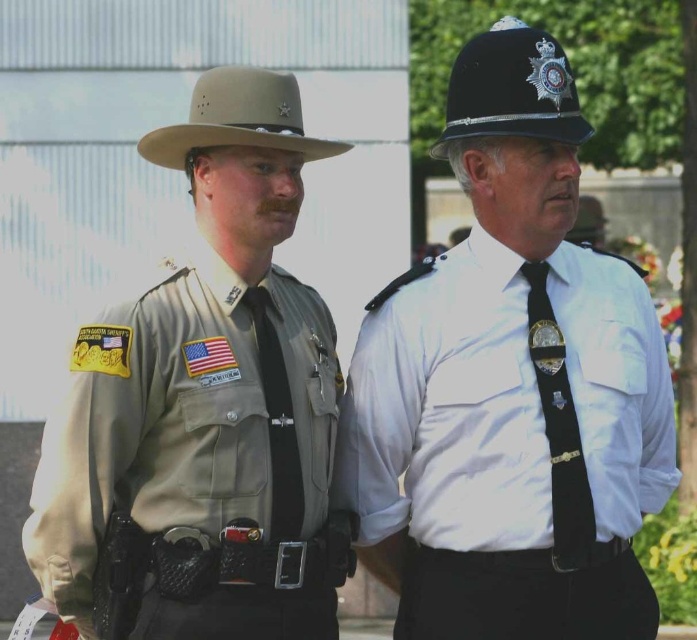
Question: Among these points, which one is farthest from the camera?

Choices:
 (A) (560, 97)
 (B) (243, 436)
 (C) (162, 157)

Answer: (C)

Question: Which is farther from the tan felt cowboy hat at upper left?

Choices:
 (A) tan uniform at left
 (B) white glossy shirt at center
 (C) black matte helmet at upper center

Answer: (B)

Question: Which object is closer to the camera taking this photo?

Choices:
 (A) white glossy shirt at center
 (B) tan uniform at left
 (C) black matte helmet at upper center

Answer: (B)

Question: Is white glossy shirt at center above tan felt cowboy hat at upper left?

Choices:
 (A) yes
 (B) no

Answer: (B)

Question: Does white glossy shirt at center have a lesser width compared to black matte helmet at upper center?

Choices:
 (A) no
 (B) yes

Answer: (A)

Question: Is white glossy shirt at center smaller than tan felt cowboy hat at upper left?

Choices:
 (A) no
 (B) yes

Answer: (A)